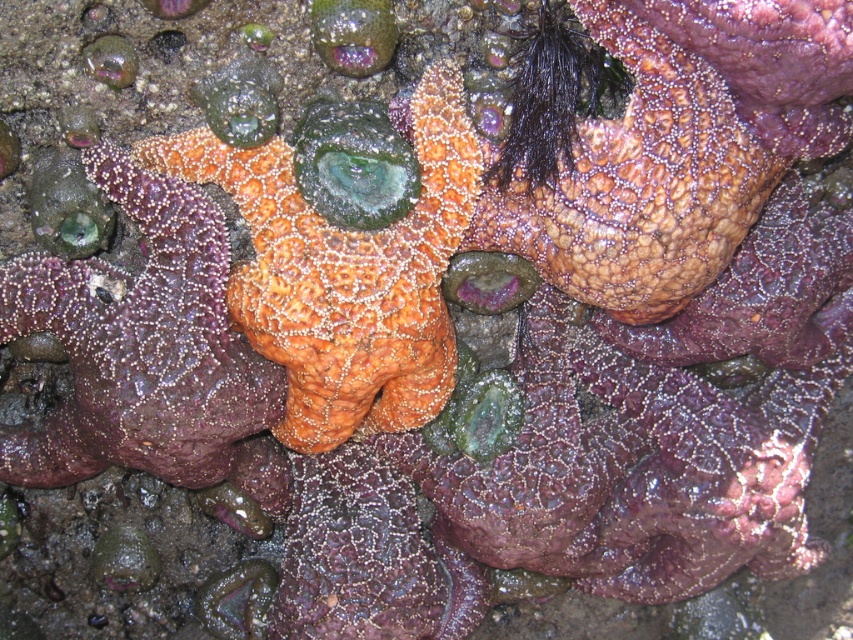
Question: Among these objects, which one is farthest from the camera?

Choices:
 (A) rough textured starfish at center
 (B) orange matte starfish at center
 (C) orange textured starfish at center

Answer: (B)

Question: Which object appears closest to the camera in this image?

Choices:
 (A) rough textured starfish at center
 (B) orange matte starfish at center
 (C) orange textured starfish at center

Answer: (A)

Question: Which point is closer to the camera?

Choices:
 (A) rough textured starfish at center
 (B) orange matte starfish at center

Answer: (A)

Question: In this image, where is orange textured starfish at center located relative to orange matte starfish at center?

Choices:
 (A) right
 (B) left

Answer: (A)

Question: Is rough textured starfish at center smaller than orange matte starfish at center?

Choices:
 (A) yes
 (B) no

Answer: (B)

Question: Does rough textured starfish at center appear over orange textured starfish at center?

Choices:
 (A) no
 (B) yes

Answer: (B)